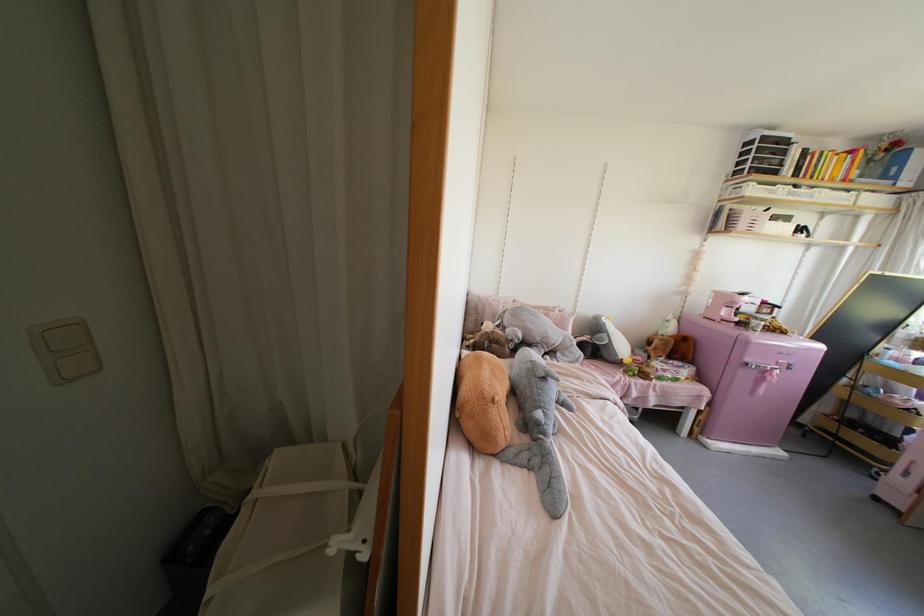
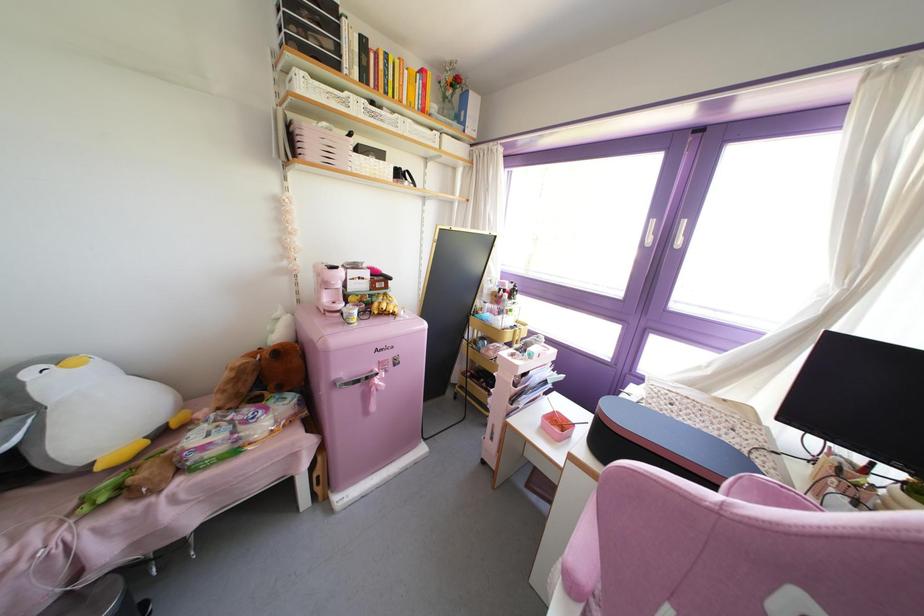
In the second image, find the point that corresponds to point 742,224 in the first image.

(310, 148)